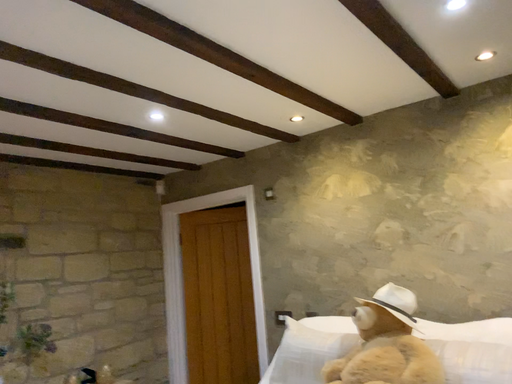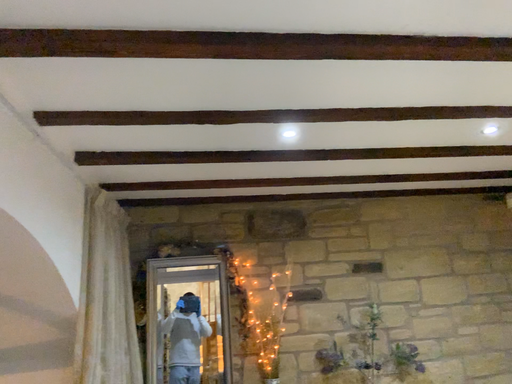
Question: Which way did the camera rotate in the video?

Choices:
 (A) rotated left
 (B) rotated right

Answer: (A)